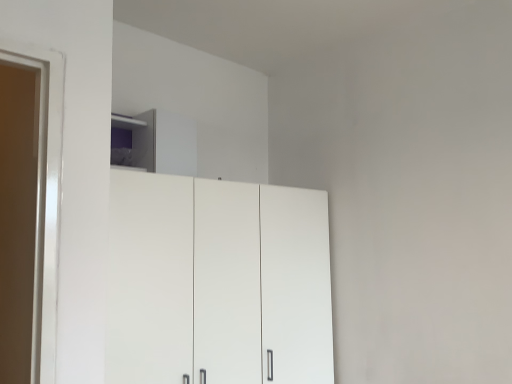
In order to face white glossy cabinet at upper center, should I rotate leftwards or rightwards?

To face it directly, rotate left by 10.696 degrees.

Locate an element on the screen. white glossy cabinet at upper center is located at coordinates (161, 142).

What do you see at coordinates (161, 142) in the screenshot? The width and height of the screenshot is (512, 384). I see `white glossy cabinet at upper center` at bounding box center [161, 142].

The width and height of the screenshot is (512, 384). I want to click on white matte cupboard at center, so click(x=217, y=282).

The height and width of the screenshot is (384, 512). What do you see at coordinates (217, 282) in the screenshot? I see `white matte cupboard at center` at bounding box center [217, 282].

Locate an element on the screen. The height and width of the screenshot is (384, 512). white glossy cabinet at upper center is located at coordinates (161, 142).

Considering the positions of objects white glossy cabinet at upper center and white matte cupboard at center in the image provided, who is more to the right, white glossy cabinet at upper center or white matte cupboard at center?

white matte cupboard at center is more to the right.

Considering their positions, is white glossy cabinet at upper center located in front of or behind white matte cupboard at center?

white glossy cabinet at upper center is behind white matte cupboard at center.

Which is farther from the camera, [138,156] or [182,260]?

The point [138,156] is behind.

From the image's perspective, which is above, white glossy cabinet at upper center or white matte cupboard at center?

From the image's view, white glossy cabinet at upper center is above.

From a real-world perspective, between white glossy cabinet at upper center and white matte cupboard at center, who is vertically lower?

white matte cupboard at center is physically lower.

Considering the sizes of objects white glossy cabinet at upper center and white matte cupboard at center in the image provided, who is thinner, white glossy cabinet at upper center or white matte cupboard at center?

white glossy cabinet at upper center is thinner.

Which of these two, white glossy cabinet at upper center or white matte cupboard at center, stands taller?

white matte cupboard at center is taller.

Based on the photo, considering the relative sizes of white glossy cabinet at upper center and white matte cupboard at center in the image provided, is white glossy cabinet at upper center bigger than white matte cupboard at center?

No, white glossy cabinet at upper center is not bigger than white matte cupboard at center.

Is white matte cupboard at center completely or partially inside white glossy cabinet at upper center?

No, white glossy cabinet at upper center does not contain white matte cupboard at center.

Are white glossy cabinet at upper center and white matte cupboard at center beside each other?

No, white glossy cabinet at upper center is not in contact with white matte cupboard at center.

Could you tell me if white glossy cabinet at upper center is turned towards white matte cupboard at center?

No, white glossy cabinet at upper center is not aimed at white matte cupboard at center.

How many degrees apart are the facing directions of white glossy cabinet at upper center and white matte cupboard at center?

white glossy cabinet at upper center and white matte cupboard at center are facing 2.3e-05 degrees away from each other.

The image size is (512, 384). I want to click on cabinetry above the white matte cupboard at center (from a real-world perspective), so click(161, 142).

Which is more to the left, white matte cupboard at center or white glossy cabinet at upper center?

From the viewer's perspective, white glossy cabinet at upper center appears more on the left side.

Between white matte cupboard at center and white glossy cabinet at upper center, which one is positioned in front?

white matte cupboard at center is more forward.

Does point (257, 380) come closer to viewer compared to point (146, 155)?

Yes, point (257, 380) is closer to viewer.

Looking at this image, from the image's perspective, is white matte cupboard at center located above or below white glossy cabinet at upper center?

Clearly, from the image's perspective, white matte cupboard at center is below white glossy cabinet at upper center.

From a real-world perspective, between white matte cupboard at center and white glossy cabinet at upper center, who is vertically lower?

white matte cupboard at center, from a real-world perspective.

Can you confirm if white matte cupboard at center is wider than white glossy cabinet at upper center?

Yes, white matte cupboard at center is wider than white glossy cabinet at upper center.

From their relative heights in the image, would you say white matte cupboard at center is taller or shorter than white glossy cabinet at upper center?

Clearly, white matte cupboard at center is taller compared to white glossy cabinet at upper center.

In terms of size, does white matte cupboard at center appear bigger or smaller than white glossy cabinet at upper center?

In the image, white matte cupboard at center appears to be larger than white glossy cabinet at upper center.

Is white glossy cabinet at upper center a part of white matte cupboard at center?

No, white glossy cabinet at upper center is not a part of white matte cupboard at center.

Would you consider white matte cupboard at center to be distant from white glossy cabinet at upper center?

They are positioned close to each other.

Consider the image. Is white matte cupboard at center oriented away from white glossy cabinet at upper center?

No.

How many degrees apart are the facing directions of white matte cupboard at center and white glossy cabinet at upper center?

The angle between the facing direction of white matte cupboard at center and the facing direction of white glossy cabinet at upper center is 2.3e-05 degrees.

This screenshot has height=384, width=512. In order to click on cupboard located on the right of white glossy cabinet at upper center in this screenshot , I will do `click(217, 282)`.

Locate an element on the screen. The width and height of the screenshot is (512, 384). cupboard below the white glossy cabinet at upper center (from a real-world perspective) is located at coordinates (217, 282).

Locate an element on the screen. cabinetry located above the white matte cupboard at center (from the image's perspective) is located at coordinates (161, 142).